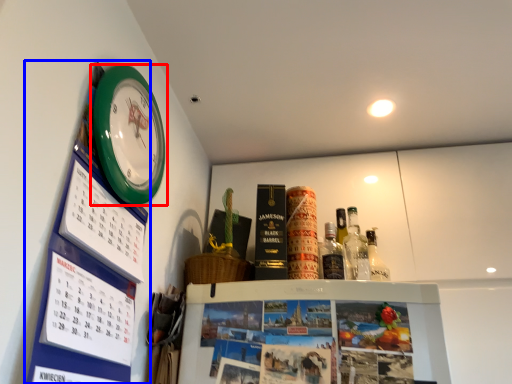
Question: Which object appears farthest to the camera in this image, wall clock (highlighted by a red box) or bulletin board (highlighted by a blue box)?

Choices:
 (A) wall clock
 (B) bulletin board

Answer: (A)